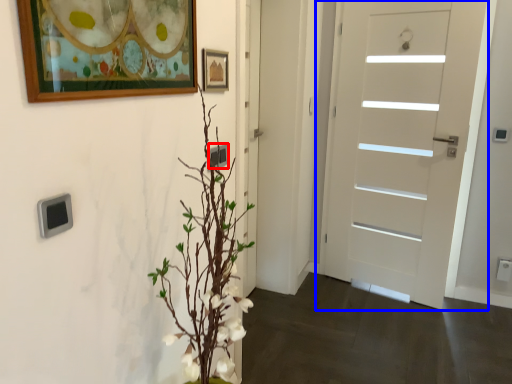
Question: Which of the following is the farthest to the observer, electric outlet (highlighted by a red box) or door (highlighted by a blue box)?

Choices:
 (A) electric outlet
 (B) door

Answer: (B)